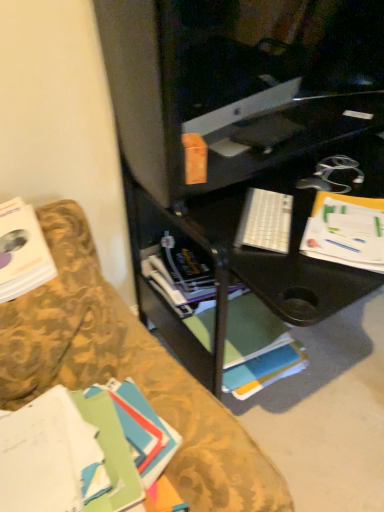
Image resolution: width=384 pixels, height=512 pixels. In order to click on white paper book at left, marked as the 2th book in a back-to-front arrangement in this screenshot , I will do `click(22, 251)`.

Where is `white paper at right`? The height and width of the screenshot is (512, 384). white paper at right is located at coordinates (346, 231).

You are a GUI agent. You are given a task and a screenshot of the screen. Output one action in this format:
    pyautogui.click(x=<x>, y=<y>)
    Task: Click on the white plastic keyboard at center
    Image resolution: width=384 pixels, height=512 pixels.
    Given the screenshot: What is the action you would take?
    coord(265,221)

From the picture: Considering the sizes of objects white matte book at center, which is the first book in back-to-front order, and white paper at right in the image provided, who is bigger, white matte book at center, which is the first book in back-to-front order, or white paper at right?

With larger size is white matte book at center, which is the first book in back-to-front order.

From the image's perspective, is white matte book at center, the 3th book positioned from the front, under white paper at right?

Correct, white matte book at center, the 3th book positioned from the front, appears lower than white paper at right in the image.

Would you say white matte book at center, the 3th book positioned from the front, is outside white paper at right?

Yes, white matte book at center, the 3th book positioned from the front, is outside of white paper at right.

Considering the relative positions of white matte book at center, the 3th book positioned from the front, and white paper at right in the image provided, is white matte book at center, the 3th book positioned from the front, to the left of white paper at right from the viewer's perspective?

Yes.

Is white matte book at center, which is the first book in back-to-front order, closer to the viewer compared to white plastic keyboard at center?

No, white matte book at center, which is the first book in back-to-front order, is further to the viewer.

Can you confirm if white matte book at center, which is the first book in back-to-front order, is bigger than white plastic keyboard at center?

Yes.

Which of these two, white matte book at center, the 3th book positioned from the front, or white plastic keyboard at center, stands taller?

white matte book at center, the 3th book positioned from the front, is taller.

Considering the sizes of objects white paper book at left, marked as the 2th book in a back-to-front arrangement, and green matte book at lower left, marked as the third book in a back-to-front arrangement, in the image provided, who is bigger, white paper book at left, marked as the 2th book in a back-to-front arrangement, or green matte book at lower left, marked as the third book in a back-to-front arrangement,?

Bigger between the two is green matte book at lower left, marked as the third book in a back-to-front arrangement.

Which is behind, white paper book at left, placed as the 2th book when sorted from front to back, or green matte book at lower left, marked as the third book in a back-to-front arrangement?

white paper book at left, placed as the 2th book when sorted from front to back, is more distant.

Which of these two, white paper book at left, marked as the 2th book in a back-to-front arrangement, or green matte book at lower left, placed as the 1th book when sorted from front to back, stands taller?

white paper book at left, marked as the 2th book in a back-to-front arrangement.

Who is smaller, white paper book at left, marked as the 2th book in a back-to-front arrangement, or white plastic keyboard at center?

white plastic keyboard at center is smaller.

Which is behind, point (4, 300) or point (267, 228)?

The point (267, 228) is behind.

From the image's perspective, who appears lower, white paper book at left, marked as the 2th book in a back-to-front arrangement, or white plastic keyboard at center?

From the image's view, white paper book at left, marked as the 2th book in a back-to-front arrangement, is below.

Does white paper book at left, placed as the 2th book when sorted from front to back, appear on the right side of white plastic keyboard at center?

Incorrect, white paper book at left, placed as the 2th book when sorted from front to back, is not on the right side of white plastic keyboard at center.

From a real-world perspective, does white plastic keyboard at center sit lower than white matte book at center, which is the first book in back-to-front order?

No, from a real-world perspective, white plastic keyboard at center is not under white matte book at center, which is the first book in back-to-front order.

From the image's perspective, is white plastic keyboard at center under white matte book at center, the 3th book positioned from the front?

No, from the image's perspective, white plastic keyboard at center is not beneath white matte book at center, the 3th book positioned from the front.

You are a GUI agent. You are given a task and a screenshot of the screen. Output one action in this format:
    pyautogui.click(x=<x>, y=<y>)
    Task: Click on the book that is the 2nd one below the white plastic keyboard at center (from a real-world perspective)
    This screenshot has width=384, height=512.
    Given the screenshot: What is the action you would take?
    pyautogui.click(x=180, y=273)

Is point (274, 237) closer or farther from the camera than point (181, 252)?

Point (274, 237).

From a real-world perspective, who is located lower, green matte book at lower left, marked as the third book in a back-to-front arrangement, or white paper at right?

green matte book at lower left, marked as the third book in a back-to-front arrangement.

Is green matte book at lower left, marked as the third book in a back-to-front arrangement, wider or thinner than white paper at right?

green matte book at lower left, marked as the third book in a back-to-front arrangement, is wider than white paper at right.

Which is nearer, (55, 406) or (334, 231)?

Point (55, 406).

Which is in front, green matte book at lower left, marked as the third book in a back-to-front arrangement, or white matte book at center, the 3th book positioned from the front?

green matte book at lower left, marked as the third book in a back-to-front arrangement, is closer to the camera.

Considering the relative sizes of green matte book at lower left, placed as the 1th book when sorted from front to back, and white matte book at center, the 3th book positioned from the front, in the image provided, is green matte book at lower left, placed as the 1th book when sorted from front to back, bigger than white matte book at center, the 3th book positioned from the front,?

No.

Considering the positions of objects green matte book at lower left, marked as the third book in a back-to-front arrangement, and white matte book at center, which is the first book in back-to-front order, in the image provided, who is more to the right, green matte book at lower left, marked as the third book in a back-to-front arrangement, or white matte book at center, which is the first book in back-to-front order,?

white matte book at center, which is the first book in back-to-front order, is more to the right.

From the image's perspective, between green matte book at lower left, placed as the 1th book when sorted from front to back, and white matte book at center, the 3th book positioned from the front, who is located below?

green matte book at lower left, placed as the 1th book when sorted from front to back, is shown below in the image.

Where is `the 1st book to the left of the white paper at right, counting from the anchor's position`? The width and height of the screenshot is (384, 512). the 1st book to the left of the white paper at right, counting from the anchor's position is located at coordinates (180, 273).

This screenshot has height=512, width=384. What are the coordinates of `book behind the white plastic keyboard at center` in the screenshot? It's located at (180, 273).

From the image, which object appears to be farther from white paper at right, white paper book at left, placed as the 2th book when sorted from front to back, or white matte book at center, which is the first book in back-to-front order?

Among the two, white paper book at left, placed as the 2th book when sorted from front to back, is located further to white paper at right.

Looking at the image, which one is located further to white plastic keyboard at center, white paper at right or white paper book at left, placed as the 2th book when sorted from front to back?

white paper book at left, placed as the 2th book when sorted from front to back, is positioned further to the anchor white plastic keyboard at center.

Estimate the real-world distances between objects in this image. Which object is closer to white matte book at center, which is the first book in back-to-front order, white paper book at left, placed as the 2th book when sorted from front to back, or white paper at right?

white paper at right lies closer to white matte book at center, which is the first book in back-to-front order, than the other object.

Considering their positions, is green matte book at lower left, placed as the 1th book when sorted from front to back, positioned further to white plastic keyboard at center than white paper at right?

Based on the image, green matte book at lower left, placed as the 1th book when sorted from front to back, appears to be further to white plastic keyboard at center.

From the picture: Considering their positions, is white paper at right positioned closer to white matte book at center, the 3th book positioned from the front, than white plastic keyboard at center?

Based on the image, white plastic keyboard at center appears to be nearer to white matte book at center, the 3th book positioned from the front.

Looking at the image, which one is located closer to white paper book at left, placed as the 2th book when sorted from front to back, white matte book at center, which is the first book in back-to-front order, or white paper at right?

white matte book at center, which is the first book in back-to-front order, is positioned closer to the anchor white paper book at left, placed as the 2th book when sorted from front to back.

Consider the image. Based on their spatial positions, is white plastic keyboard at center or white paper book at left, marked as the 2th book in a back-to-front arrangement, further from white matte book at center, the 3th book positioned from the front?

white paper book at left, marked as the 2th book in a back-to-front arrangement, is further to white matte book at center, the 3th book positioned from the front.

When comparing their distances from white plastic keyboard at center, does white paper book at left, placed as the 2th book when sorted from front to back, or white matte book at center, which is the first book in back-to-front order, seem further?

Based on the image, white paper book at left, placed as the 2th book when sorted from front to back, appears to be further to white plastic keyboard at center.

Image resolution: width=384 pixels, height=512 pixels. What are the coordinates of `keyboard situated between green matte book at lower left, marked as the third book in a back-to-front arrangement, and white paper at right from left to right` in the screenshot? It's located at (265, 221).

This screenshot has height=512, width=384. What are the coordinates of `book between green matte book at lower left, marked as the third book in a back-to-front arrangement, and white matte book at center, which is the first book in back-to-front order, in the front-back direction` in the screenshot? It's located at (22, 251).

At what (x,y) coordinates should I click in order to perform the action: click on keyboard between white paper at right and white matte book at center, the 3th book positioned from the front, along the z-axis. Please return your answer as a coordinate pair (x, y). The image size is (384, 512). Looking at the image, I should click on (265, 221).

You are a GUI agent. You are given a task and a screenshot of the screen. Output one action in this format:
    pyautogui.click(x=<x>, y=<y>)
    Task: Click on the keyboard located between white paper book at left, placed as the 2th book when sorted from front to back, and white paper at right in the left-right direction
    The width and height of the screenshot is (384, 512).
    Given the screenshot: What is the action you would take?
    pyautogui.click(x=265, y=221)